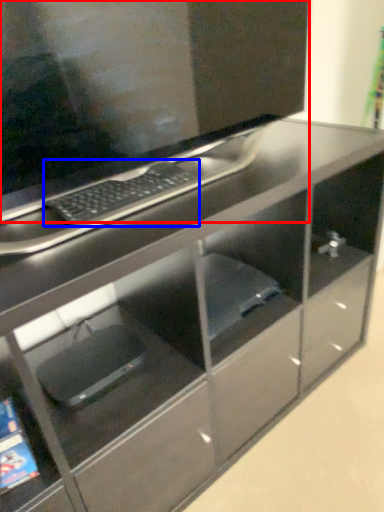
Question: Which of the following is the closest to the observer, computer monitor (highlighted by a red box) or computer keyboard (highlighted by a blue box)?

Choices:
 (A) computer monitor
 (B) computer keyboard

Answer: (A)